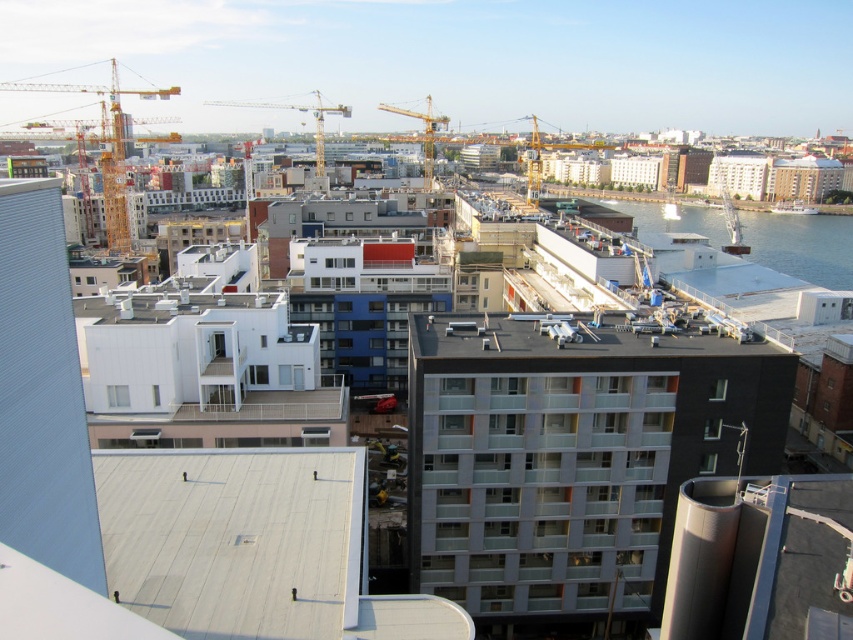
You are standing at the point with coordinates point [802,244] in the urban landscape. What is the terrain like at that location?

The point [802,244] is on clear blue water at lower right, so the terrain is water.

Looking at this image, you are a delivery drone operator. Your drone has a maximum flight distance of 50 meters. You need to deliver a package to the matte glass building at center. Can your drone reach it?

The matte glass building at center is 48.79 meters away from the viewer, so yes, the drone can reach it since the distance is within its 50 meters maximum flight range.

You are a construction worker standing at the point marked as point (107, 150) in the image. You need to move to the nearest construction material storage area located at the yellow metallic crane at upper left. Is your current position already at the storage area?

Point (107, 150) corresponds to the yellow metallic crane at upper left, so yes, your current position is already at the storage area.